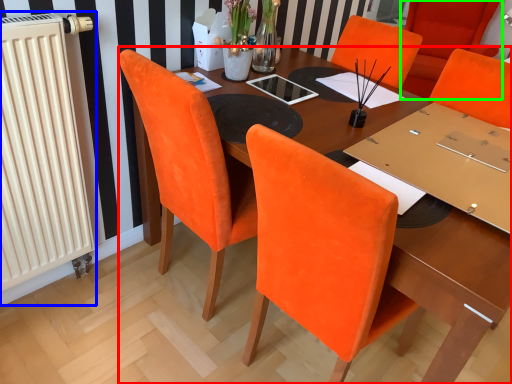
Question: Based on their relative distances, which object is farther from table (highlighted by a red box)? Choose from radiator (highlighted by a blue box) and chair (highlighted by a green box).

Choices:
 (A) radiator
 (B) chair

Answer: (B)